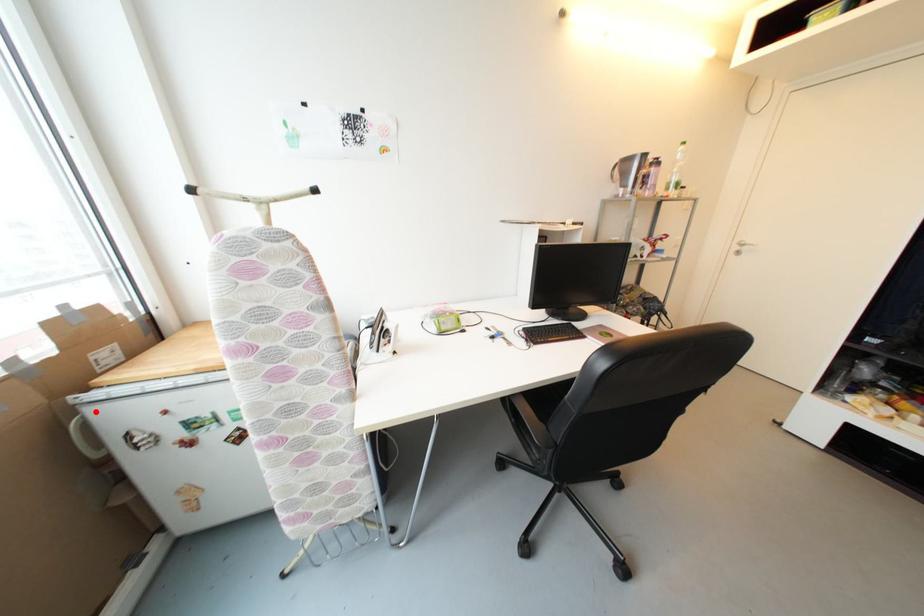
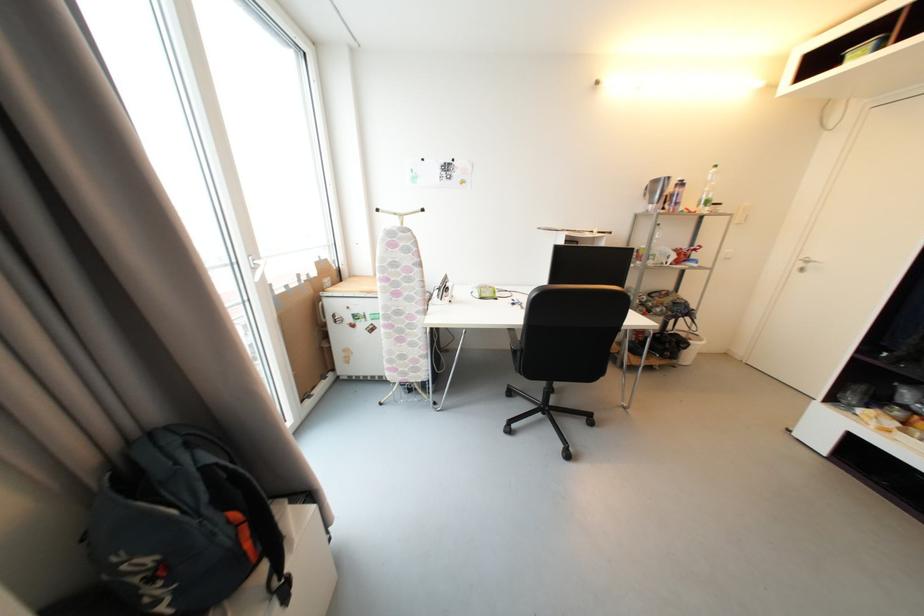
Locate, in the second image, the point that corresponds to the highlighted location in the first image.

(330, 302)